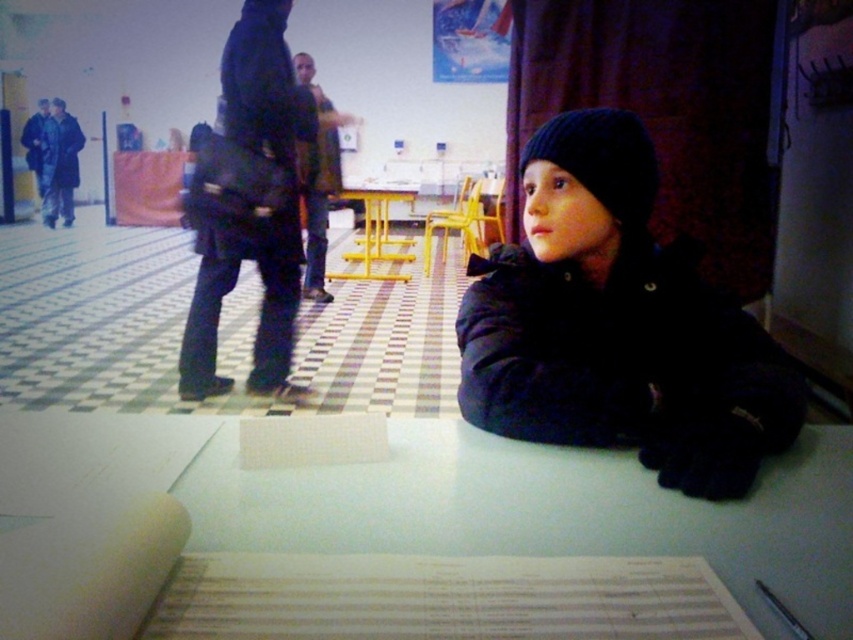
You are organizing a craft activity for children and need to place a white paper at center and a yellow metal table at center in a way that both are visible. Given their sizes, which object should you place closer to the front to ensure both are fully visible?

The white paper at center occupies less space than the yellow metal table at center, so you should place the white paper at center closer to the front to ensure both are fully visible.

You are standing at the point labeled as point (601,128) in the image. You want to walk towards the point labeled as point (431,492). Which direction should you move to get closer to your destination?

You should move forward because point (431,492) is in front of point (601,128).